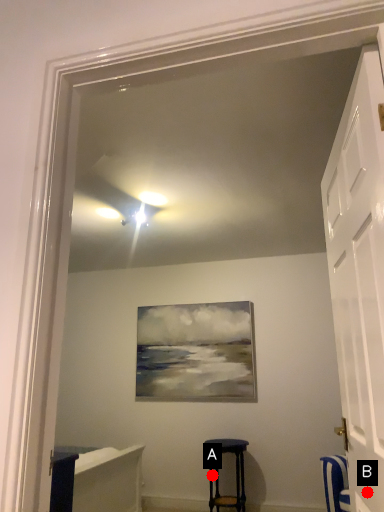
Question: Two points are circled on the image, labeled by A and B beside each circle. Which point is closer to the camera?

Choices:
 (A) A is closer
 (B) B is closer

Answer: (B)